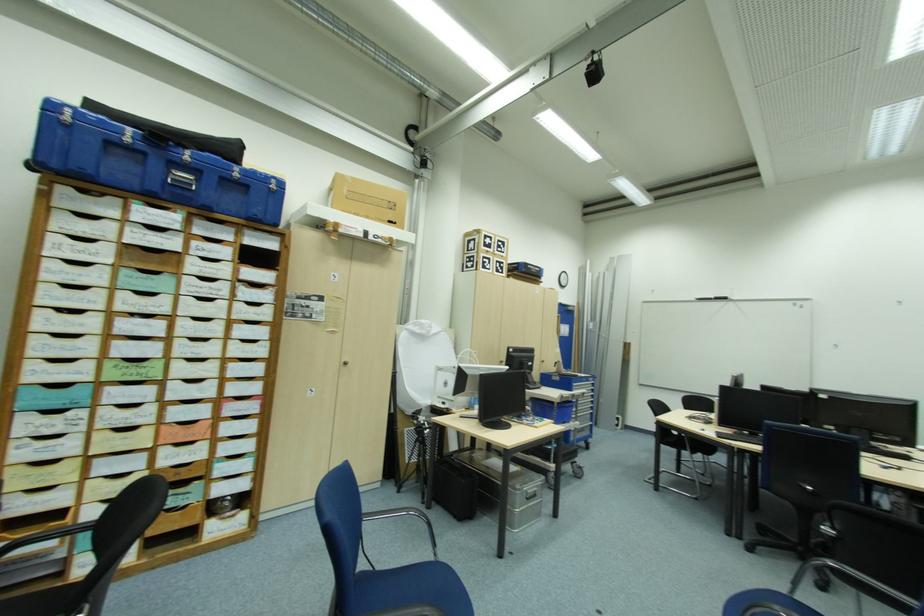
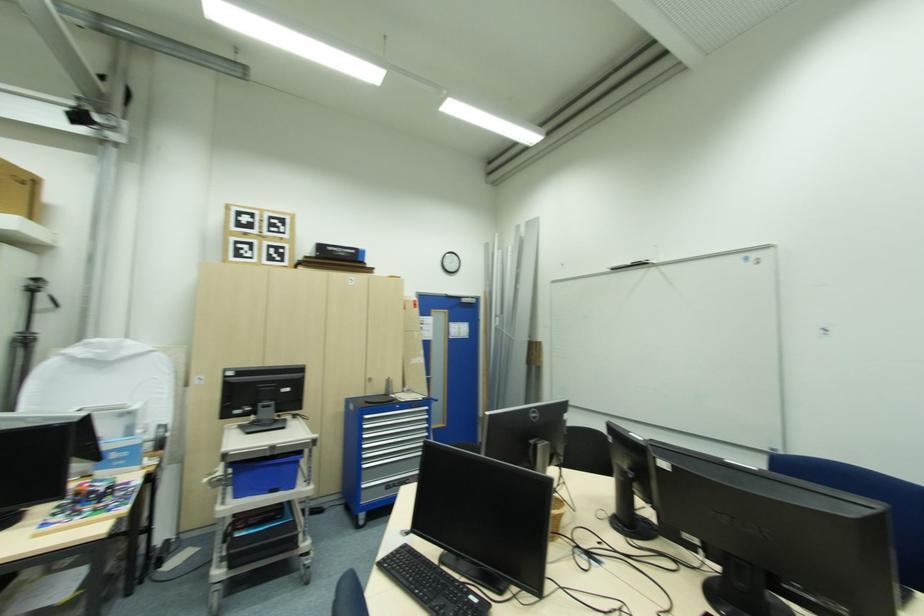
In a continuous first-person perspective shot, in which direction is the camera moving?

The movement direction of the cameraman is right, forward.